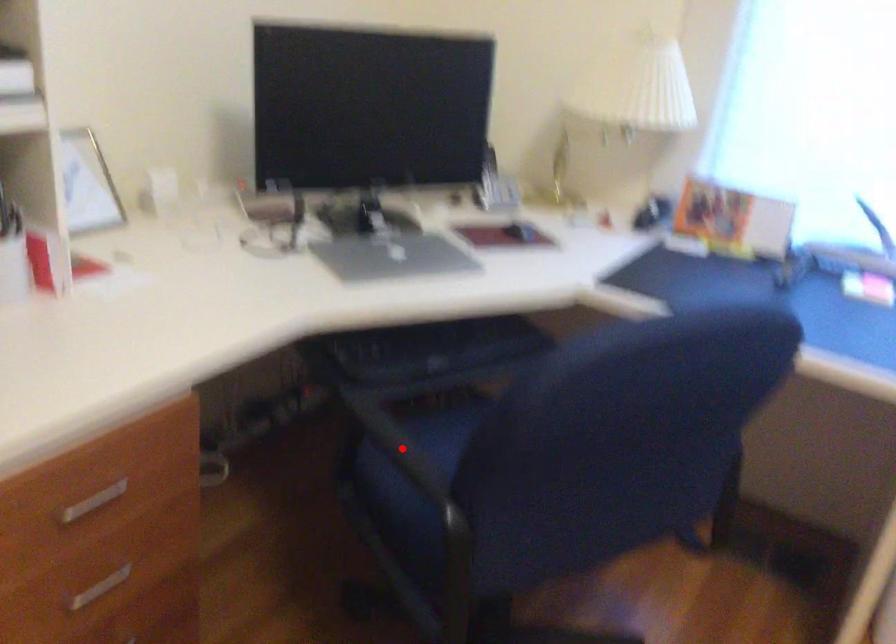
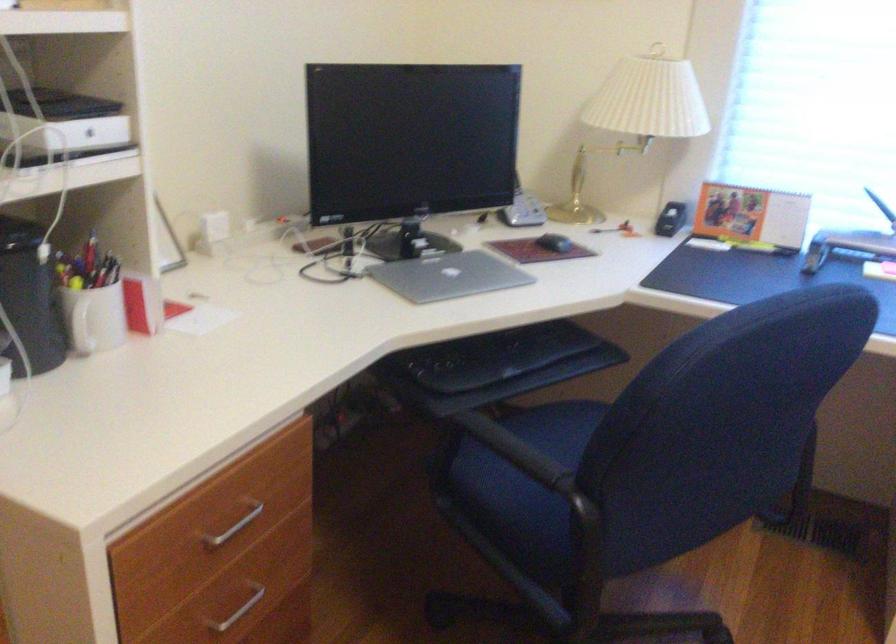
Find the pixel in the second image that matches the highlighted location in the first image.

(513, 450)